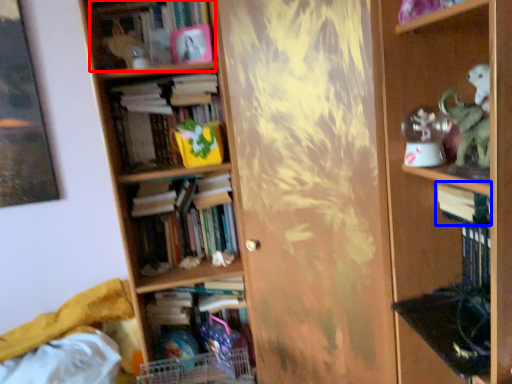
Question: Which of the following is the closest to the observer, book (highlighted by a red box) or book (highlighted by a blue box)?

Choices:
 (A) book
 (B) book

Answer: (B)